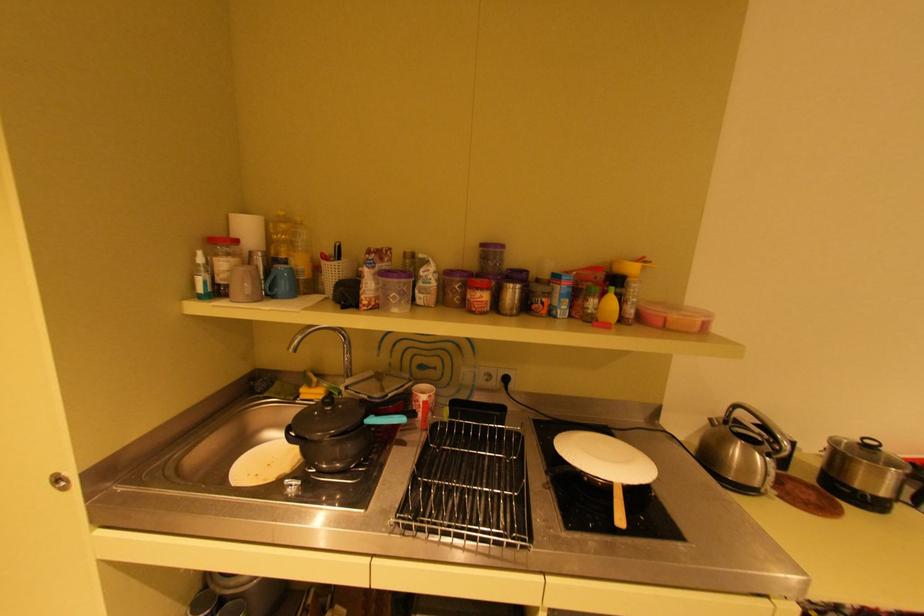
Image resolution: width=924 pixels, height=616 pixels. Find the location of `silver faucet handle`. silver faucet handle is located at coordinates (325, 342).